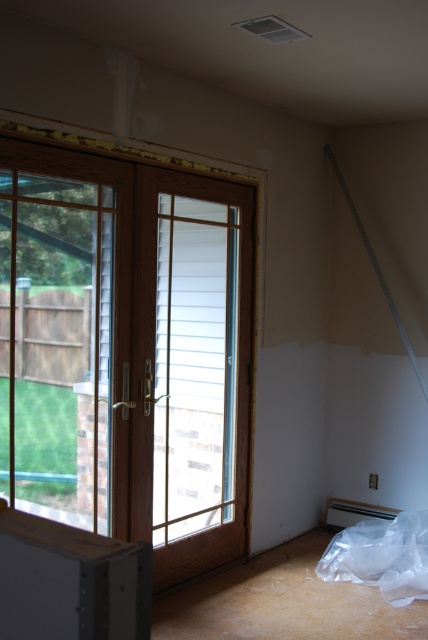
Can you confirm if clear glass door at left is positioned to the left of brown wooden screen door at center?

Correct, you'll find clear glass door at left to the left of brown wooden screen door at center.

Is clear glass door at left taller than brown wooden screen door at center?

Indeed, clear glass door at left has a greater height compared to brown wooden screen door at center.

The image size is (428, 640). I want to click on clear glass door at left, so [127, 349].